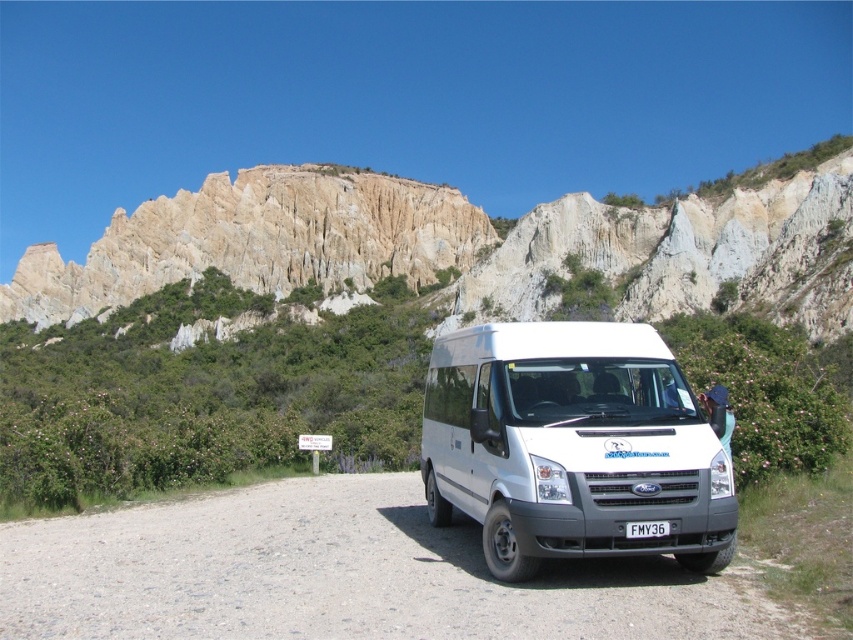
Question: Which point is farther from the camera taking this photo?

Choices:
 (A) (541, 221)
 (B) (94, 632)
 (C) (579, 481)

Answer: (A)

Question: Is rustic stone cliff at upper center below white matte van at center?

Choices:
 (A) no
 (B) yes

Answer: (A)

Question: Based on their relative distances, which object is farther from the rustic stone cliff at upper center?

Choices:
 (A) gray gravel road at center
 (B) white matte van at center

Answer: (A)

Question: Does rustic stone cliff at upper center come behind white matte van at center?

Choices:
 (A) yes
 (B) no

Answer: (A)

Question: Observing the image, what is the correct spatial positioning of rustic stone cliff at upper center in reference to gray gravel road at center?

Choices:
 (A) below
 (B) above

Answer: (B)

Question: Which object is positioned farthest from the white matte van at center?

Choices:
 (A) gray gravel road at center
 (B) rustic stone cliff at upper center

Answer: (B)